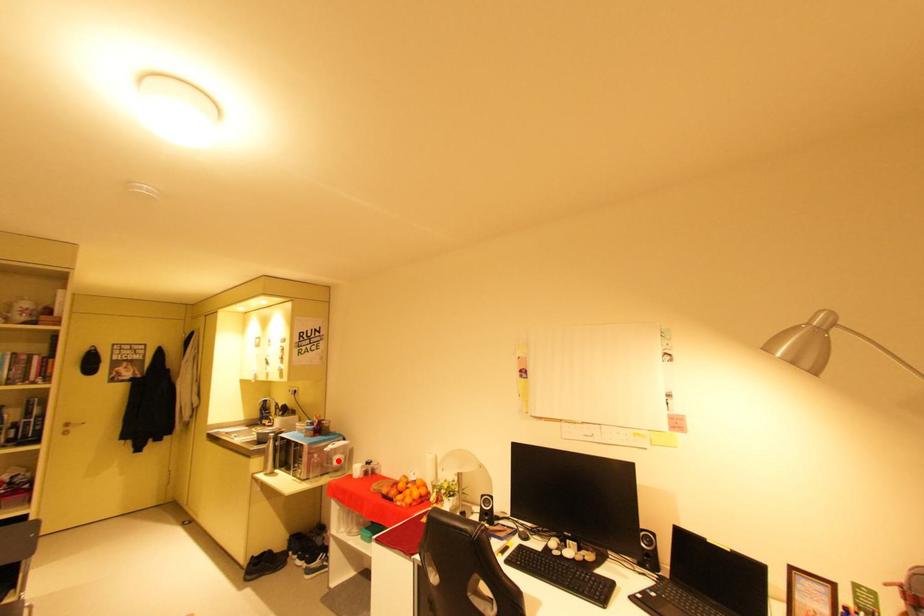
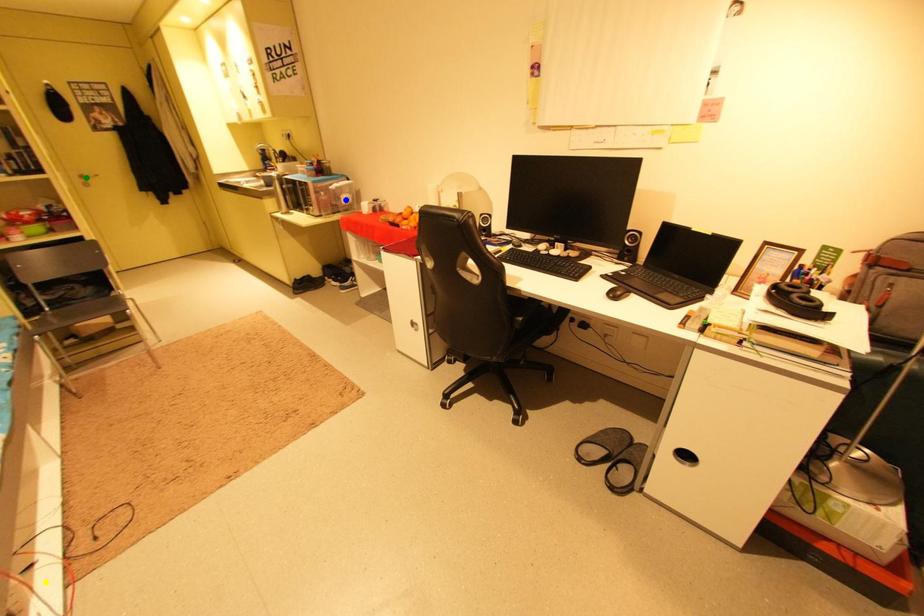
Question: I am providing you with two images of the same scene from different viewpoints. A red point is marked on the first image. You are given multiple points on the second image. Can you choose the point in image 2 that corresponds to the point in image 1?

Choices:
 (A) green point
 (B) blue point
 (C) yellow point

Answer: (B)